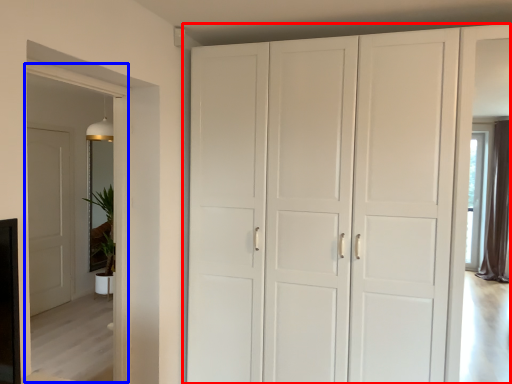
Question: Which point is further to the camera, cupboard (highlighted by a red box) or glass door (highlighted by a blue box)?

Choices:
 (A) cupboard
 (B) glass door

Answer: (A)